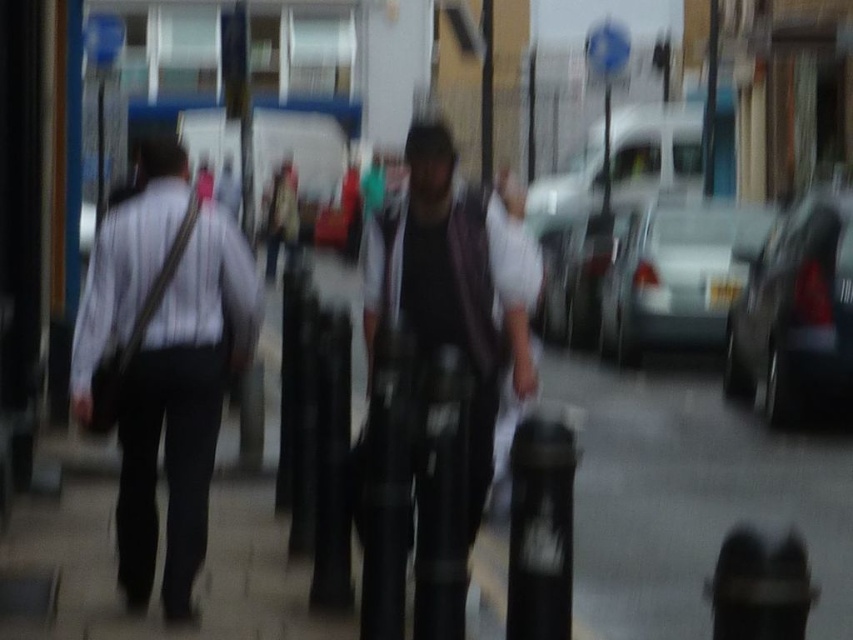
Question: Does dark gray fabric jacket at center come in front of shiny black car at right?

Choices:
 (A) yes
 (B) no

Answer: (A)

Question: Does white striped shirt at left have a lesser width compared to silver metallic sedan at center?

Choices:
 (A) no
 (B) yes

Answer: (B)

Question: Among these points, which one is farthest from the camera?

Choices:
 (A) (612, 289)
 (B) (376, 320)

Answer: (A)

Question: Which object appears farthest from the camera in this image?

Choices:
 (A) white striped shirt at left
 (B) silver metallic sedan at center

Answer: (B)

Question: Which of the following is the closest to the observer?

Choices:
 (A) silver metallic sedan at center
 (B) dark gray fabric jacket at center
 (C) white striped shirt at left
 (D) shiny black car at right

Answer: (B)

Question: Is white striped shirt at left positioned behind silver metallic sedan at center?

Choices:
 (A) yes
 (B) no

Answer: (B)